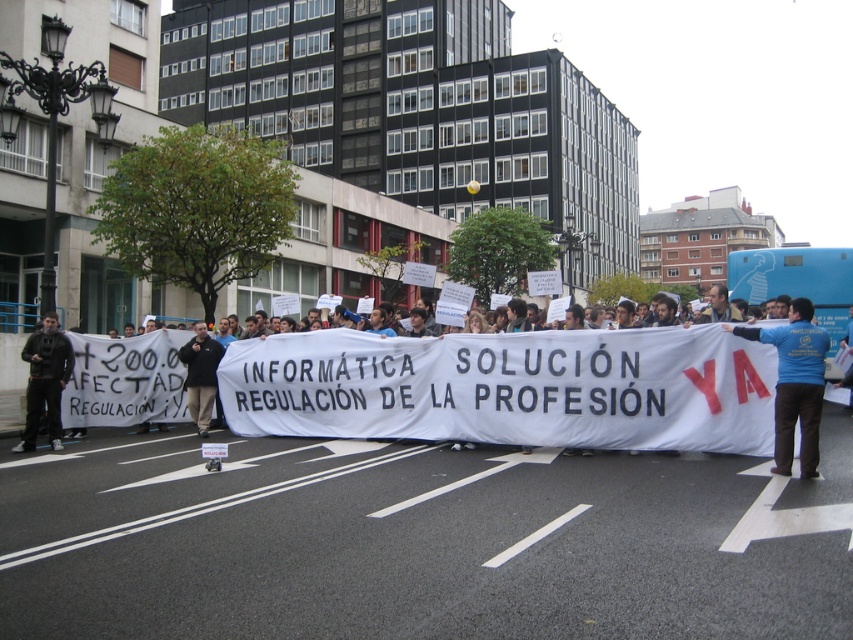
Question: Which of the following is the farthest from the observer?

Choices:
 (A) (45, 358)
 (B) (653, 404)

Answer: (A)

Question: Does blue t-shirt at center lie in front of dark blue shirt at center?

Choices:
 (A) no
 (B) yes

Answer: (B)

Question: Does blue t-shirt at center have a greater width compared to dark gray jacket at left?

Choices:
 (A) yes
 (B) no

Answer: (B)

Question: Which object is closer to the camera taking this photo?

Choices:
 (A) dark blue shirt at center
 (B) blue t-shirt at center
 (C) dark gray jacket at left
 (D) blue shirt at center

Answer: (B)

Question: Does blue shirt at center appear on the right side of blue t-shirt at center?

Choices:
 (A) no
 (B) yes

Answer: (A)

Question: Considering the real-world distances, which object is closest to the dark gray jacket at left?

Choices:
 (A) blue t-shirt at center
 (B) dark blue shirt at center

Answer: (B)